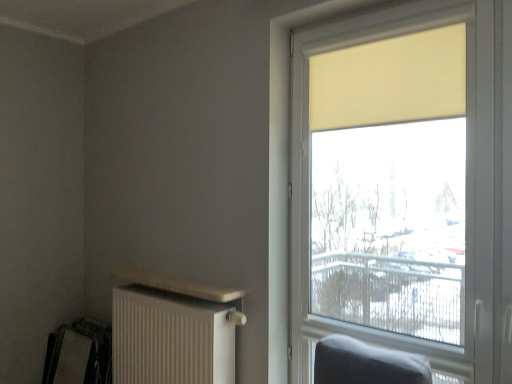
Question: Does matte yellow roller shade at right lie in front of beige fabric curtain at upper right?

Choices:
 (A) no
 (B) yes

Answer: (B)

Question: From a real-world perspective, is matte yellow roller shade at right physically below beige fabric curtain at upper right?

Choices:
 (A) yes
 (B) no

Answer: (A)

Question: From a real-world perspective, does matte yellow roller shade at right stand above beige fabric curtain at upper right?

Choices:
 (A) no
 (B) yes

Answer: (A)

Question: Considering the relative sizes of matte yellow roller shade at right and beige fabric curtain at upper right in the image provided, is matte yellow roller shade at right taller than beige fabric curtain at upper right?

Choices:
 (A) yes
 (B) no

Answer: (A)

Question: Is the position of matte yellow roller shade at right more distant than that of beige fabric curtain at upper right?

Choices:
 (A) no
 (B) yes

Answer: (A)

Question: Based on their positions, is metallic silver swivel chair at lower left located to the left or right of matte yellow roller shade at right?

Choices:
 (A) right
 (B) left

Answer: (B)

Question: From the image's perspective, relative to matte yellow roller shade at right, is metallic silver swivel chair at lower left above or below?

Choices:
 (A) below
 (B) above

Answer: (A)

Question: From a real-world perspective, is metallic silver swivel chair at lower left physically located above or below matte yellow roller shade at right?

Choices:
 (A) above
 (B) below

Answer: (B)

Question: In the image, is metallic silver swivel chair at lower left positioned in front of or behind matte yellow roller shade at right?

Choices:
 (A) front
 (B) behind

Answer: (B)

Question: In the image, is beige fabric curtain at upper right on the left side or the right side of metallic silver swivel chair at lower left?

Choices:
 (A) left
 (B) right

Answer: (B)

Question: In terms of size, does beige fabric curtain at upper right appear bigger or smaller than metallic silver swivel chair at lower left?

Choices:
 (A) big
 (B) small

Answer: (B)

Question: From the image's perspective, is beige fabric curtain at upper right above or below metallic silver swivel chair at lower left?

Choices:
 (A) above
 (B) below

Answer: (A)

Question: Considering the positions of beige fabric curtain at upper right and metallic silver swivel chair at lower left in the image, is beige fabric curtain at upper right wider or thinner than metallic silver swivel chair at lower left?

Choices:
 (A) thin
 (B) wide

Answer: (A)

Question: Is point (352, 41) closer or farther from the camera than point (164, 340)?

Choices:
 (A) farther
 (B) closer

Answer: (B)

Question: Relative to white textured radiator at lower left, is matte yellow roller shade at right in front or behind?

Choices:
 (A) behind
 (B) front

Answer: (B)